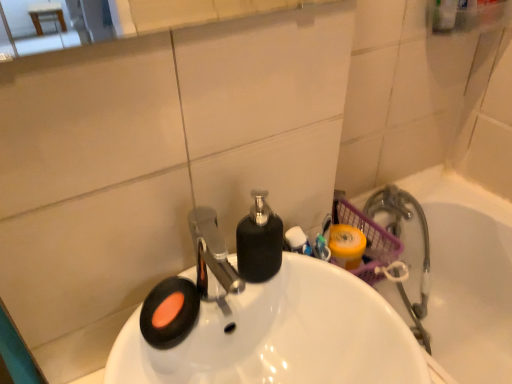
Looking at this image, in order to face white glossy sink at center, should I rotate leftwards or rightwards?

It's best to rotate right around 1.632 degrees.

Find the location of a particular element. The height and width of the screenshot is (384, 512). white glossy sink at center is located at coordinates [283, 336].

Image resolution: width=512 pixels, height=384 pixels. What do you see at coordinates (283, 336) in the screenshot? I see `white glossy sink at center` at bounding box center [283, 336].

Locate an element on the screen. Image resolution: width=512 pixels, height=384 pixels. translucent plastic basket at right is located at coordinates (467, 275).

Consider the image. What is the approximate width of translucent plastic basket at right?

translucent plastic basket at right is 16.35 inches wide.

Describe the element at coordinates (467, 275) in the screenshot. I see `translucent plastic basket at right` at that location.

Identify the location of white glossy sink at center. This screenshot has height=384, width=512. (283, 336).

Between translucent plastic basket at right and white glossy sink at center, which one appears on the left side from the viewer's perspective?

Positioned to the left is white glossy sink at center.

In the image, is translucent plastic basket at right positioned in front of or behind white glossy sink at center?

translucent plastic basket at right is positioned farther from the viewer than white glossy sink at center.

Which is behind, point (500, 235) or point (386, 329)?

The point (500, 235) is more distant.

From the image's perspective, relative to white glossy sink at center, is translucent plastic basket at right above or below?

Based on their image positions, translucent plastic basket at right is located beneath white glossy sink at center.

From a real-world perspective, is translucent plastic basket at right over white glossy sink at center?

No, from a real-world perspective, translucent plastic basket at right is not over white glossy sink at center

Which object is thinner, translucent plastic basket at right or white glossy sink at center?

With smaller width is translucent plastic basket at right.

Can you confirm if translucent plastic basket at right is taller than white glossy sink at center?

Indeed, translucent plastic basket at right has a greater height compared to white glossy sink at center.

Looking at the image, does translucent plastic basket at right seem bigger or smaller compared to white glossy sink at center?

Clearly, translucent plastic basket at right is larger in size than white glossy sink at center.

Would you say translucent plastic basket at right is inside or outside white glossy sink at center?

translucent plastic basket at right is outside white glossy sink at center.

Is translucent plastic basket at right far from white glossy sink at center?

translucent plastic basket at right is near white glossy sink at center, not far away.

Is translucent plastic basket at right oriented towards white glossy sink at center?

No, translucent plastic basket at right is not facing towards white glossy sink at center.

How many degrees apart are the facing directions of translucent plastic basket at right and white glossy sink at center?

translucent plastic basket at right and white glossy sink at center are facing 0.181 degrees away from each other.

Where is `bath below the white glossy sink at center (from a real-world perspective)`? The height and width of the screenshot is (384, 512). bath below the white glossy sink at center (from a real-world perspective) is located at coordinates (467, 275).

Is white glossy sink at center to the right of translucent plastic basket at right from the viewer's perspective?

No.

Relative to translucent plastic basket at right, is white glossy sink at center in front or behind?

white glossy sink at center is positioned closer to the viewer than translucent plastic basket at right.

Based on the photo, which is closer to the camera, [167,357] or [487,337]?

The point [167,357] is more forward.

From the image's perspective, is white glossy sink at center above translucent plastic basket at right?

Yes, from the image's perspective, white glossy sink at center is above translucent plastic basket at right.

From a real-world perspective, which is physically above, white glossy sink at center or translucent plastic basket at right?

white glossy sink at center, from a real-world perspective.

Considering the relative sizes of white glossy sink at center and translucent plastic basket at right in the image provided, is white glossy sink at center wider than translucent plastic basket at right?

Correct, the width of white glossy sink at center exceeds that of translucent plastic basket at right.

Considering the sizes of objects white glossy sink at center and translucent plastic basket at right in the image provided, who is shorter, white glossy sink at center or translucent plastic basket at right?

Standing shorter between the two is white glossy sink at center.

Does white glossy sink at center have a smaller size compared to translucent plastic basket at right?

Indeed, white glossy sink at center has a smaller size compared to translucent plastic basket at right.

Is white glossy sink at center not inside translucent plastic basket at right?

Indeed, white glossy sink at center is completely outside translucent plastic basket at right.

Is white glossy sink at center far from translucent plastic basket at right?

No.

Is white glossy sink at center oriented towards translucent plastic basket at right?

No.

Consider the image. How many degrees apart are the facing directions of white glossy sink at center and translucent plastic basket at right?

They differ by 0.181 degrees in their facing directions.

Locate an element on the screen. bath below the white glossy sink at center (from the image's perspective) is located at coordinates (467, 275).

Locate an element on the screen. The width and height of the screenshot is (512, 384). sink above the translucent plastic basket at right (from the image's perspective) is located at coordinates (283, 336).

The height and width of the screenshot is (384, 512). I want to click on bath beneath the white glossy sink at center (from a real-world perspective), so click(x=467, y=275).